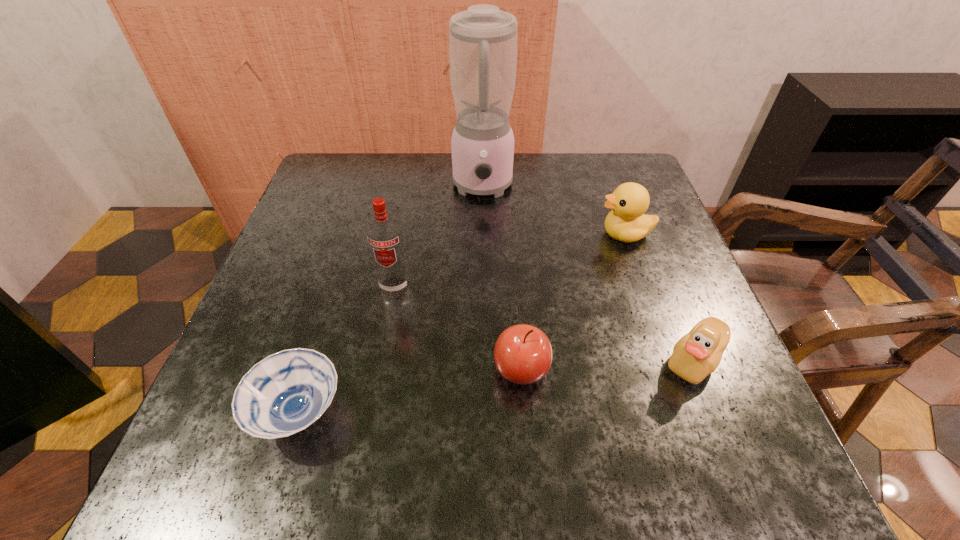
The width and height of the screenshot is (960, 540). I want to click on food processor, so click(483, 39).

Image resolution: width=960 pixels, height=540 pixels. I want to click on the tallest object, so click(483, 39).

Image resolution: width=960 pixels, height=540 pixels. Find the location of `vodka`. vodka is located at coordinates (384, 234).

Find the location of a particular element. The width and height of the screenshot is (960, 540). the fourth nearest object is located at coordinates [x=384, y=234].

This screenshot has width=960, height=540. What are the coordinates of `the fourth shortest object` in the screenshot? It's located at (627, 222).

Identify the location of the farther duck. (627, 222).

Locate an element on the screen. The width and height of the screenshot is (960, 540). apple is located at coordinates (523, 354).

Identify the location of the nearer duck. The width and height of the screenshot is (960, 540). (697, 354).

You are a GUI agent. You are given a task and a screenshot of the screen. Output one action in this format:
    pyautogui.click(x=<x>, y=<y>)
    Task: Click on the shortest object
    The image size is (960, 540).
    Given the screenshot: What is the action you would take?
    pyautogui.click(x=285, y=393)

Locate an element on the screen. The image size is (960, 540). the leftmost object is located at coordinates (285, 393).